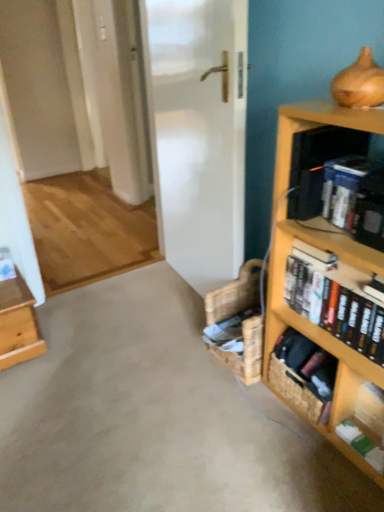
What are the coordinates of `vacant area to the left of woven brown basket at lower right` in the screenshot? It's located at (263, 410).